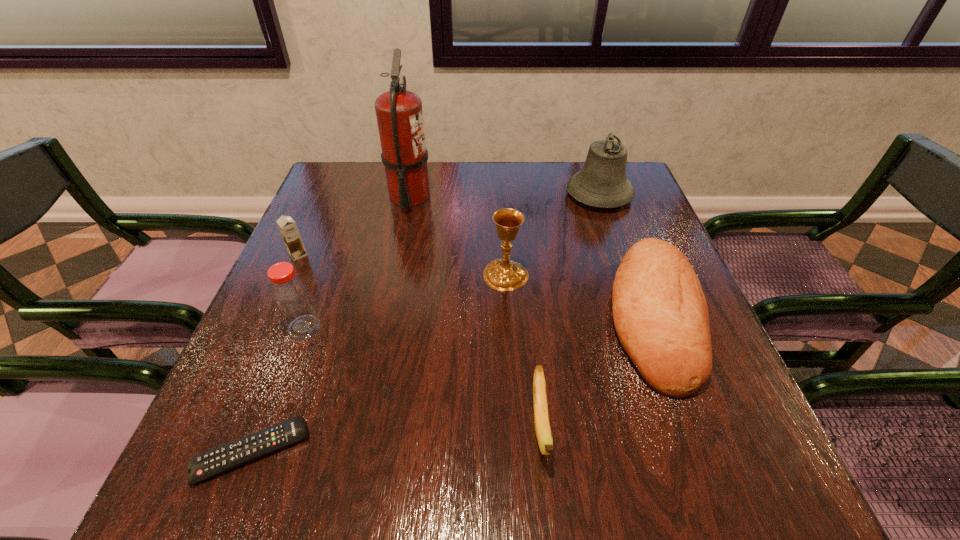
Identify the location of free space located 0.290m on the front of the bell. (633, 294).

You are a GUI agent. You are given a task and a screenshot of the screen. Output one action in this format:
    pyautogui.click(x=<x>, y=<y>)
    Task: Click on the vacant region located 0.210m on the left of the chalice
    This screenshot has height=540, width=960.
    Given the screenshot: What is the action you would take?
    pyautogui.click(x=391, y=275)

You are a GUI agent. You are given a task and a screenshot of the screen. Output one action in this format:
    pyautogui.click(x=<x>, y=<y>)
    Task: Click on the free space located on the back of the bottle
    
    Given the screenshot: What is the action you would take?
    pyautogui.click(x=325, y=269)

Image resolution: width=960 pixels, height=540 pixels. Find the location of `free spot located on the back of the chocolate milk`. free spot located on the back of the chocolate milk is located at coordinates (314, 219).

Locate an element on the screen. free space located on the front of the bread is located at coordinates (715, 482).

This screenshot has width=960, height=540. What are the coordinates of `blank space located 0.290m on the back of the shortest object` in the screenshot? It's located at (310, 296).

Where is `fire extinguisher present at the far edge`? This screenshot has height=540, width=960. fire extinguisher present at the far edge is located at coordinates (399, 114).

Identify the location of bell that is positioned at the far edge. (602, 182).

Locate an element on the screen. banana that is positioned at the near edge is located at coordinates (541, 416).

Locate an element on the screen. The image size is (960, 540). remote control that is at the near edge is located at coordinates (225, 457).